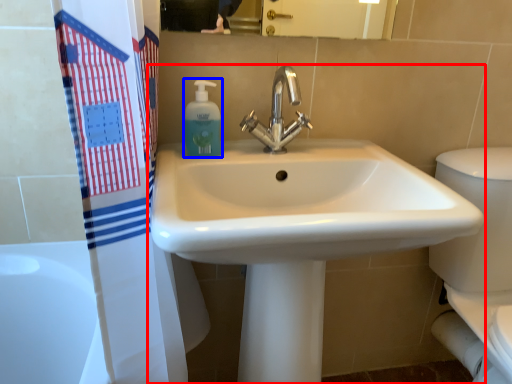
Question: Which point is closer to the camera, sink (highlighted by a red box) or soap dispenser (highlighted by a blue box)?

Choices:
 (A) sink
 (B) soap dispenser

Answer: (A)